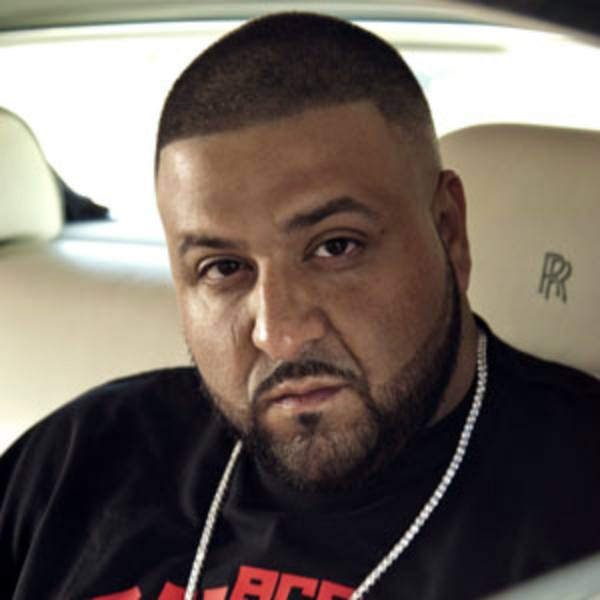
Identify the location of headrests. The width and height of the screenshot is (600, 600). (541, 223), (17, 189).